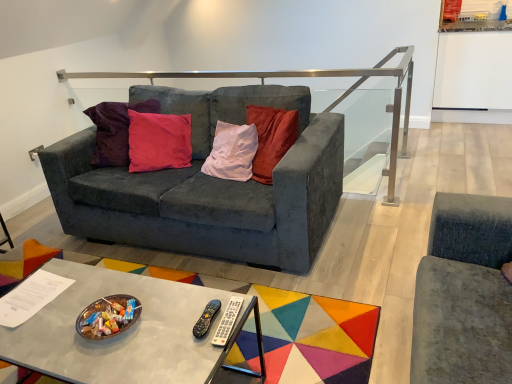
You are a GUI agent. You are given a task and a screenshot of the screen. Output one action in this format:
    pyautogui.click(x=<x>, y=<y>)
    Task: Click on the free space that is to the left of silver plastic remote at center, the 2th remote when ordered from left to right
    This screenshot has width=512, height=384.
    Given the screenshot: What is the action you would take?
    pyautogui.click(x=169, y=325)